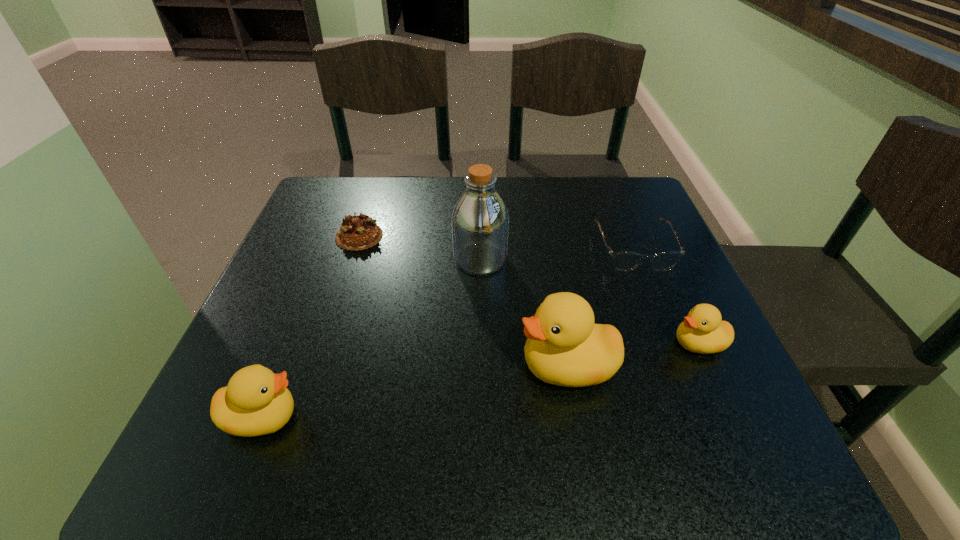
Find the location of a particular element. The height and width of the screenshot is (540, 960). free space located 0.320m on the face of the third tallest object is located at coordinates (502, 417).

Identify the location of free space located on the face of the second tallest object. (330, 366).

At what (x,y) coordinates should I click in order to perform the action: click on free region located on the face of the second tallest object. Please return your answer as a coordinate pair (x, y). Looking at the image, I should click on (483, 366).

I want to click on free location located on the face of the second tallest object, so click(x=296, y=366).

Locate an element on the screen. free spot located on the face of the shortest duckling is located at coordinates [x=644, y=343].

Identify the location of free space located 0.250m on the face of the shortest duckling. The image size is (960, 540). (536, 343).

Find the location of `vacant space situated on the face of the shortest duckling`. vacant space situated on the face of the shortest duckling is located at coordinates [x=552, y=343].

Locate an element on the screen. The height and width of the screenshot is (540, 960). vacant space located on the back of the chocolate cake is located at coordinates (368, 211).

Find the location of a particular element. vacant space located on the left of the tallest object is located at coordinates (427, 260).

I want to click on vacant space located on the front-facing side of the spectacles, so click(657, 307).